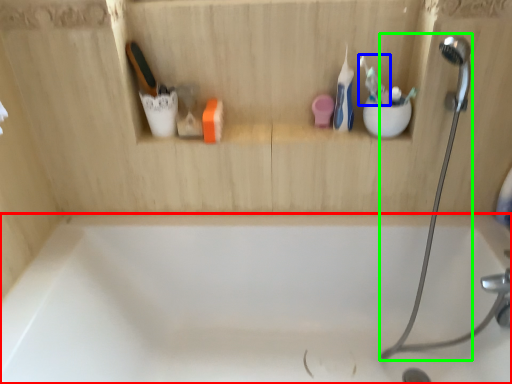
Question: Estimate the real-world distances between objects in this image. Which object is farther from bathtub (highlighted by a red box), toothbrush (highlighted by a blue box) or shower (highlighted by a green box)?

Choices:
 (A) toothbrush
 (B) shower

Answer: (A)